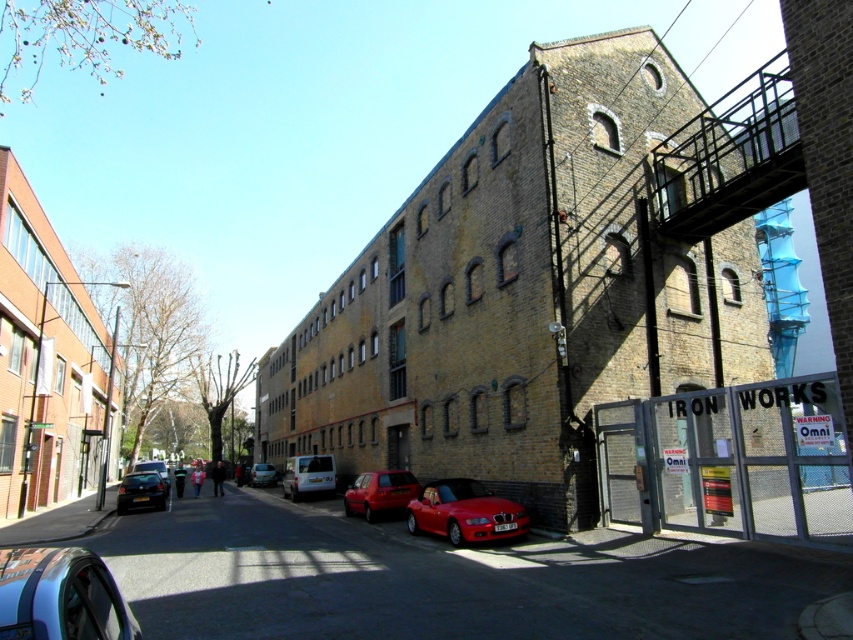
You are a delivery person needing to park your truck between the matte red van at center and the shiny black car at lower left. The truck requires 12 meters of space. Can you fit it there?

The distance between the matte red van at center and the shiny black car at lower left is 11.98 meters, which is slightly less than the required 12 meters. Therefore, the truck cannot fit in that space.

You are standing at the entrance of the large brick building and see the point marked as point (x=439, y=579). What object is located at that point?

The metallic red car at center is located at point (x=439, y=579).

You are a delivery driver who needs to park your vehicle in a space that is 2 meters wide. You see a matte red van at center and a shiny black car at lower left in the parking area. Which vehicle would require a wider parking space based on their widths?

The shiny black car at lower left requires a wider parking space since the matte red van at center is thinner than it according to the description.